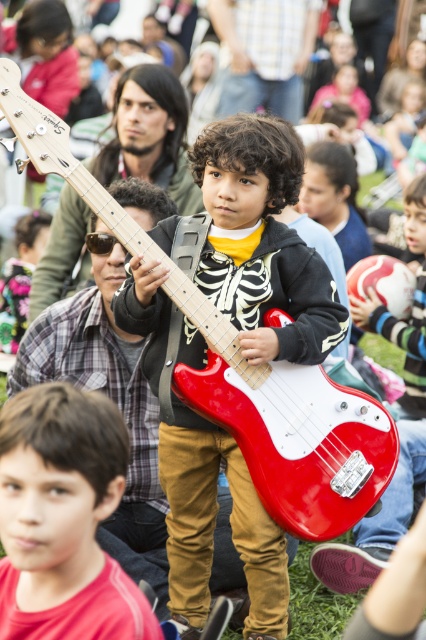
Which of these two, matte red guitar at center or matte black guitar at center, stands taller?

matte black guitar at center

Does matte red guitar at center appear under matte black guitar at center?

Indeed, matte red guitar at center is positioned under matte black guitar at center.

The height and width of the screenshot is (640, 426). What do you see at coordinates (63, 518) in the screenshot?
I see `matte red guitar at center` at bounding box center [63, 518].

The width and height of the screenshot is (426, 640). Find the location of `matte red guitar at center`. matte red guitar at center is located at coordinates (63, 518).

Does glossy red electric guitar at center come behind matte wood guitar at center?

No, it is in front of matte wood guitar at center.

Identify the location of glossy red electric guitar at center. (247, 376).

Is the position of matte wood guitar at center less distant than that of glossy red guitar at center?

No, matte wood guitar at center is behind glossy red guitar at center.

Is point (181, 109) positioned before point (409, 362)?

No, it is behind (409, 362).

Where is `matte wood guitar at center`? matte wood guitar at center is located at coordinates (149, 134).